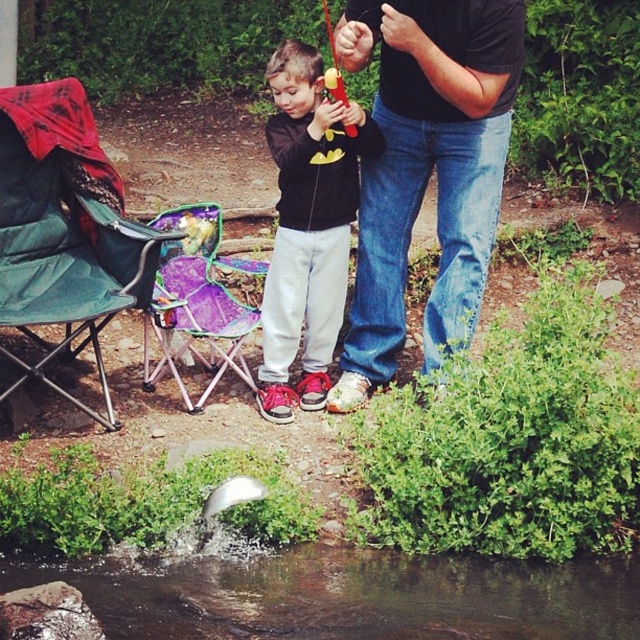
You are standing at the point labeled as point (342, 209) and want to walk towards the point labeled as point (301, 604). According to the scene description, will you be moving forward or backward relative to your current position?

Since point (301, 604) is in front of point (342, 209), moving towards it would mean you are moving forward relative to your current position.

You are standing at the edge of the stream and want to sit down. There is a green fabric chair at left and clear water at lower center. Which one is closer to you?

The clear water at lower center is closer to you because it is in front of the green fabric chair at left.

You are a photographer wanting to capture the scene with the green fabric chair at left and the matte black hoodie at center. Which object is located above the other?

The matte black hoodie at center is positioned above the green fabric chair at left.